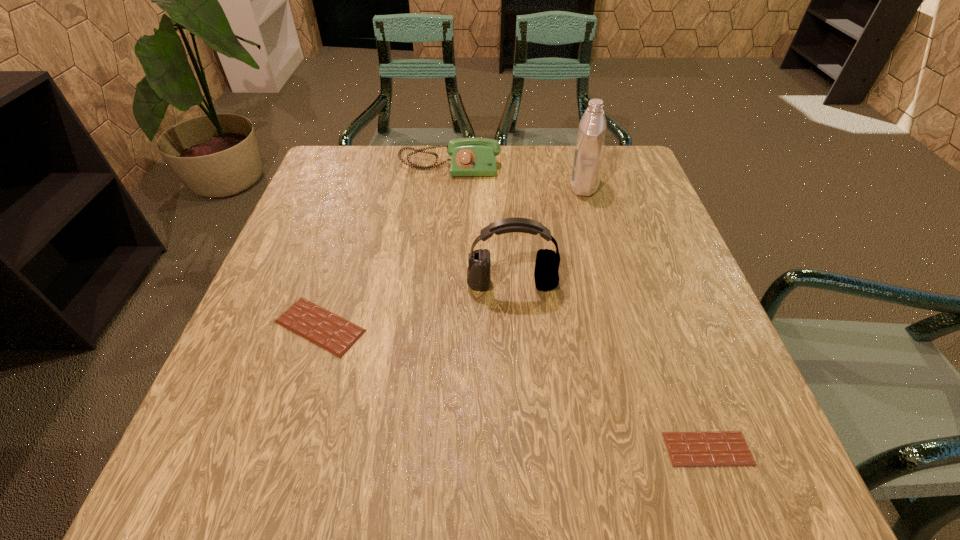
At what (x,y) coordinates should I click in order to perform the action: click on object present at the near right corner. Please return your answer as a coordinate pair (x, y). Looking at the image, I should click on (717, 448).

Find the location of a particular element. The height and width of the screenshot is (540, 960). free location at the far edge is located at coordinates (526, 181).

This screenshot has width=960, height=540. I want to click on vacant space at the near edge, so click(x=410, y=443).

This screenshot has width=960, height=540. Find the location of `vacant space at the left edge of the desktop`. vacant space at the left edge of the desktop is located at coordinates (296, 367).

Find the location of a particular element. This screenshot has height=540, width=960. vacant space at the right edge of the desktop is located at coordinates (654, 243).

Where is `vacant area at the far left corner of the desktop`? vacant area at the far left corner of the desktop is located at coordinates (336, 162).

I want to click on free space at the near left corner of the desktop, so tap(226, 467).

Image resolution: width=960 pixels, height=540 pixels. What are the coordinates of `free region at the far right corner of the desktop` in the screenshot? It's located at (x=626, y=169).

Where is `unoccupied area between the tallest object and the telephone`? unoccupied area between the tallest object and the telephone is located at coordinates (516, 177).

Locate an element on the screen. The height and width of the screenshot is (540, 960). unoccupied area between the taller chocolate bar and the second tallest object is located at coordinates (416, 305).